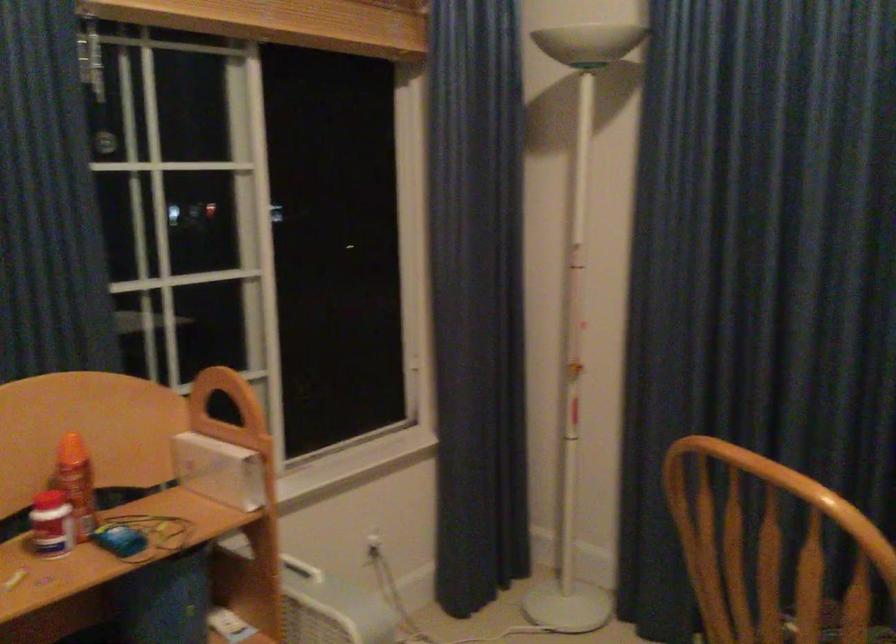
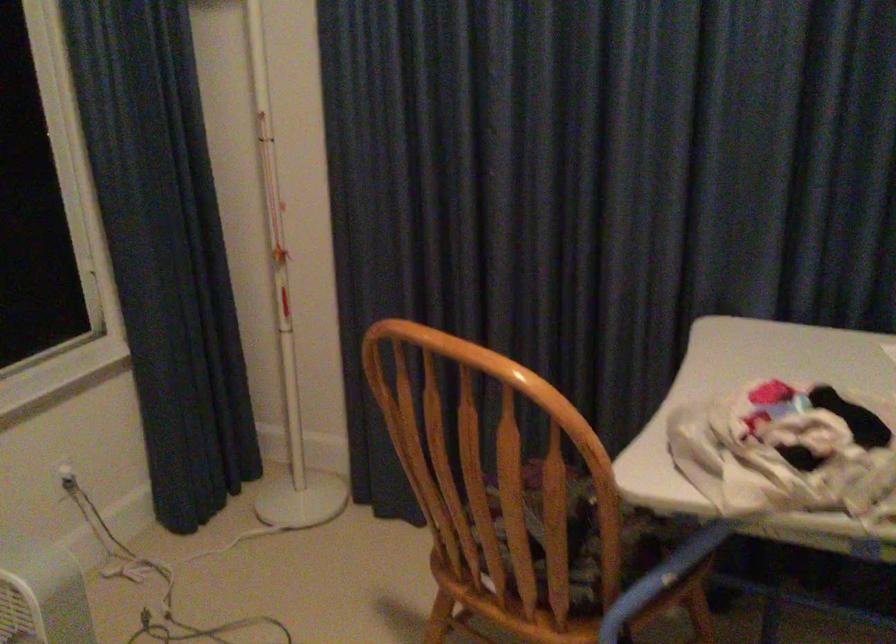
Where in the second image is the point corresponding to the point at 369,547 from the first image?

(65, 478)